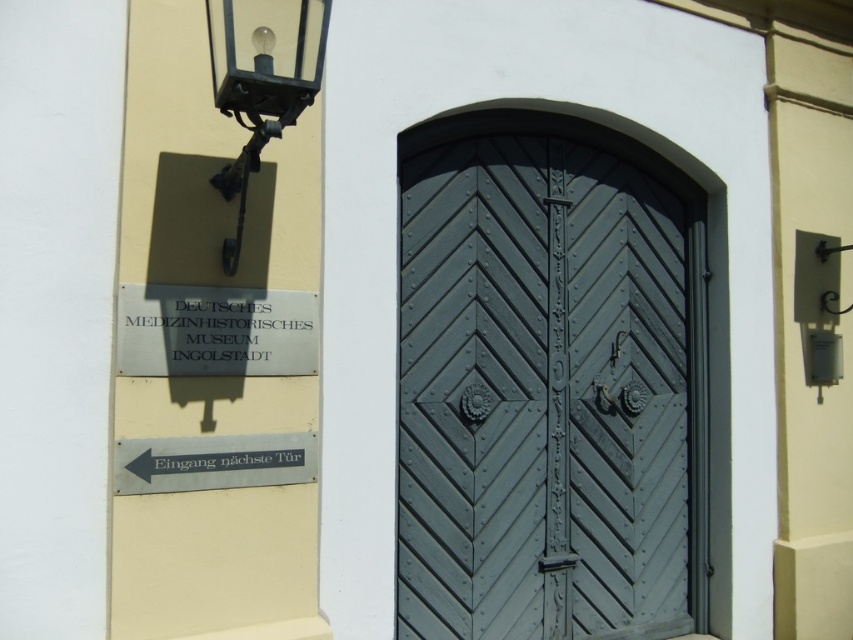
Does matte black lamp at upper left appear over silver metallic sign at lower left?

Yes.

The image size is (853, 640). I want to click on matte black lamp at upper left, so click(260, 81).

Identify the location of matte black lamp at upper left. (260, 81).

Which is more to the left, silver metallic sign at upper left or silver metallic sign at lower left?

silver metallic sign at lower left is more to the left.

Is silver metallic sign at upper left further to the viewer compared to silver metallic sign at lower left?

Yes, silver metallic sign at upper left is behind silver metallic sign at lower left.

Where is `silver metallic sign at upper left`? Image resolution: width=853 pixels, height=640 pixels. silver metallic sign at upper left is located at coordinates (215, 332).

Between matte gray wood door at center and matte black lamp at upper left, which one is positioned lower?

matte gray wood door at center is lower down.

Can you confirm if matte gray wood door at center is positioned below matte black lamp at upper left?

Correct, matte gray wood door at center is located below matte black lamp at upper left.

Locate an element on the screen. matte gray wood door at center is located at coordinates (549, 384).